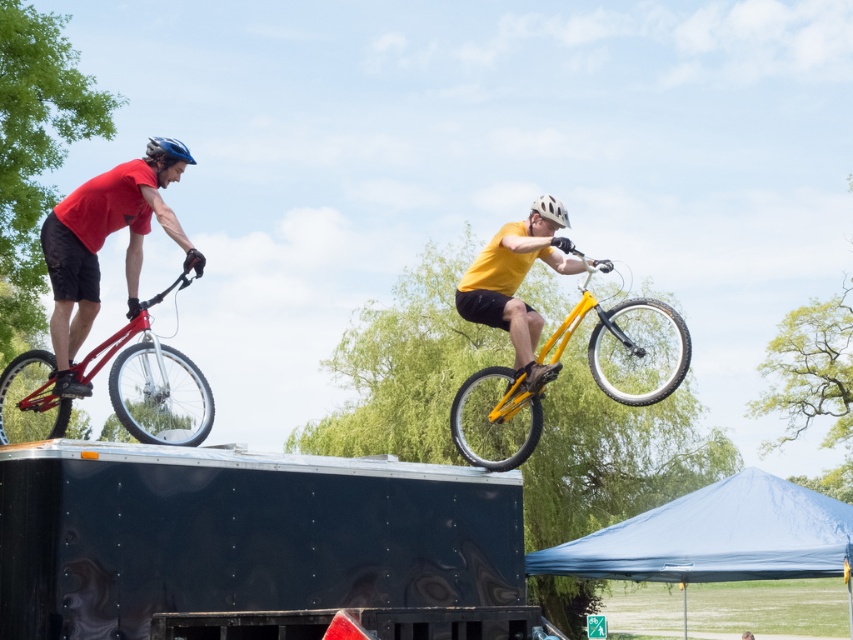
You are a photographer trying to capture both the yellow matte mountain bike at center and the matte black bicycle at left in a single shot. Based on their positions, which bicycle should you focus on first to ensure both are in frame?

The yellow matte mountain bike at center is positioned on the right side of matte black bicycle at left, so you should focus on the matte black bicycle at left first to ensure both are in frame.

You are a photographer standing in the park and want to capture both the yellow matte mountain bike at center and the matte blue helmet at upper left in a single shot. Based on their positions, which object should you adjust your camera to focus on first to ensure both are in frame?

Since the yellow matte mountain bike at center is to the right of the matte blue helmet at upper left, you should focus on the matte blue helmet at upper left first, then pan your camera to include the yellow matte mountain bike at center in the frame.